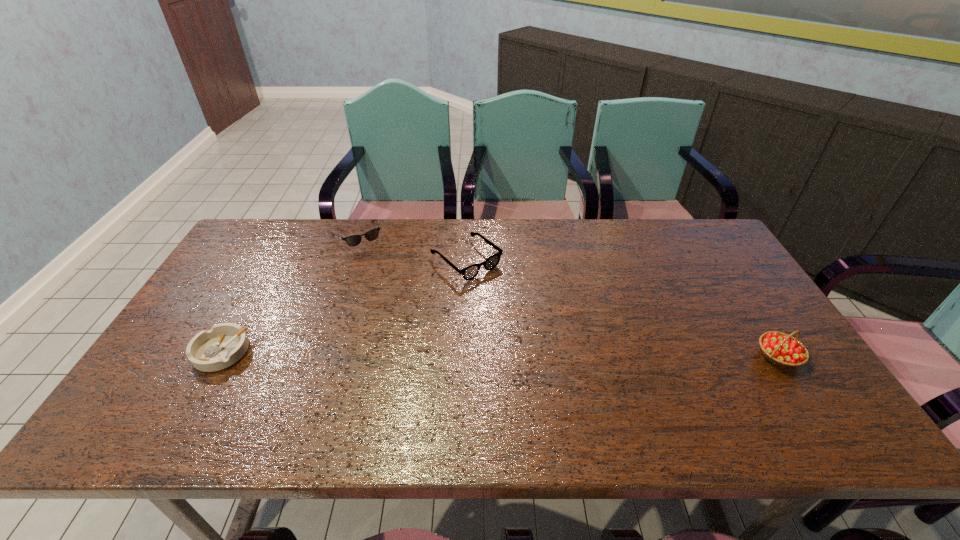
Locate an element on the screen. The image size is (960, 540). free point between the leftmost object and the sunglasses is located at coordinates (289, 294).

At what (x,y) coordinates should I click in order to perform the action: click on free space between the sunglasses and the leftmost object. Please return your answer as a coordinate pair (x, y). Image resolution: width=960 pixels, height=540 pixels. Looking at the image, I should click on coord(289,294).

Image resolution: width=960 pixels, height=540 pixels. Identify the location of free space between the shortest object and the sunglasses. coord(289,294).

You are a GUI agent. You are given a task and a screenshot of the screen. Output one action in this format:
    pyautogui.click(x=<x>, y=<y>)
    Task: Click on the vacant area that lies between the tallest object and the leftmost object
    This screenshot has height=540, width=960.
    Given the screenshot: What is the action you would take?
    500,354

Find the location of a particular element. The height and width of the screenshot is (540, 960). vacant area that lies between the tallest object and the ashtray is located at coordinates (500, 354).

This screenshot has width=960, height=540. I want to click on free point between the ashtray and the spectacles, so click(344, 306).

At what (x,y) coordinates should I click in order to perform the action: click on empty space between the strawberry and the sunglasses. Please return your answer as a coordinate pair (x, y). Looking at the image, I should click on [x=567, y=296].

Identify the location of vacant area between the leftmost object and the spectacles. The image size is (960, 540). (344, 306).

This screenshot has width=960, height=540. Find the location of `object that stands as the second closest to the spectacles`. object that stands as the second closest to the spectacles is located at coordinates (223, 345).

Locate which object ranks in proximity to the second object from left to right. Please provide its 2D coordinates. Your answer should be formatted as a tuple, i.e. [(x, y)], where the tuple contains the x and y coordinates of a point satisfying the conditions above.

[(470, 272)]